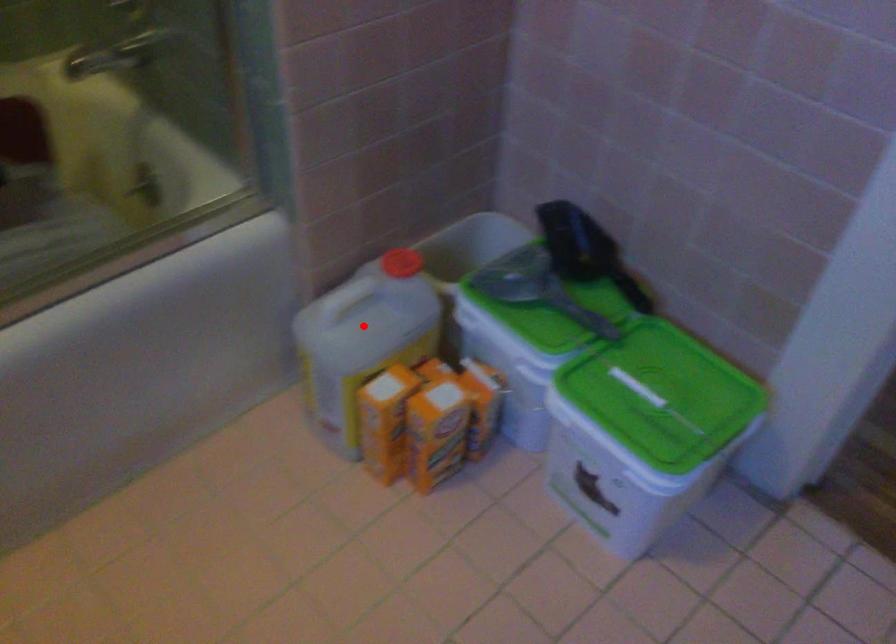
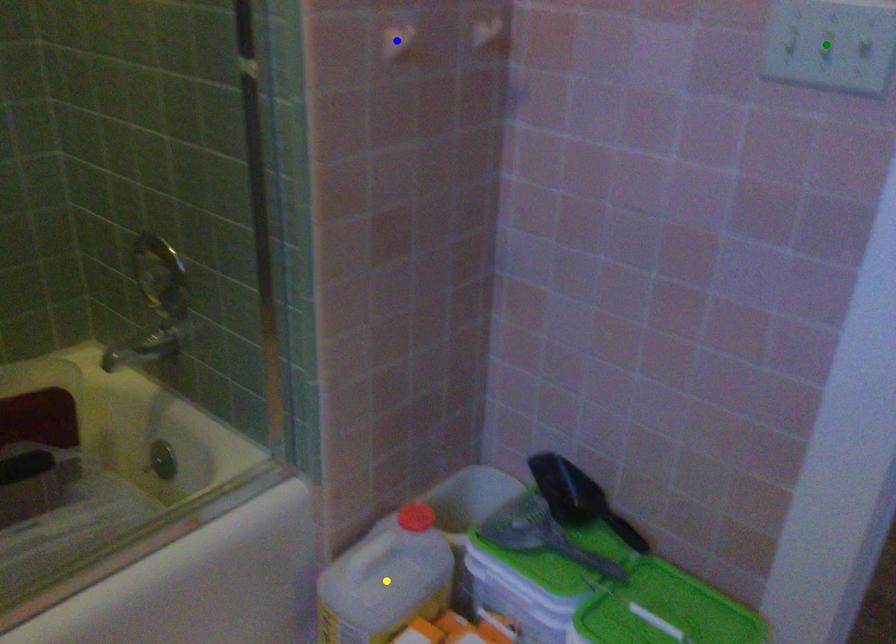
Question: I am providing you with two images of the same scene from different viewpoints. A red point is marked on the first image. You are given multiple points on the second image. Which spot in image 2 lines up with the point in image 1?

Choices:
 (A) blue point
 (B) yellow point
 (C) green point

Answer: (B)